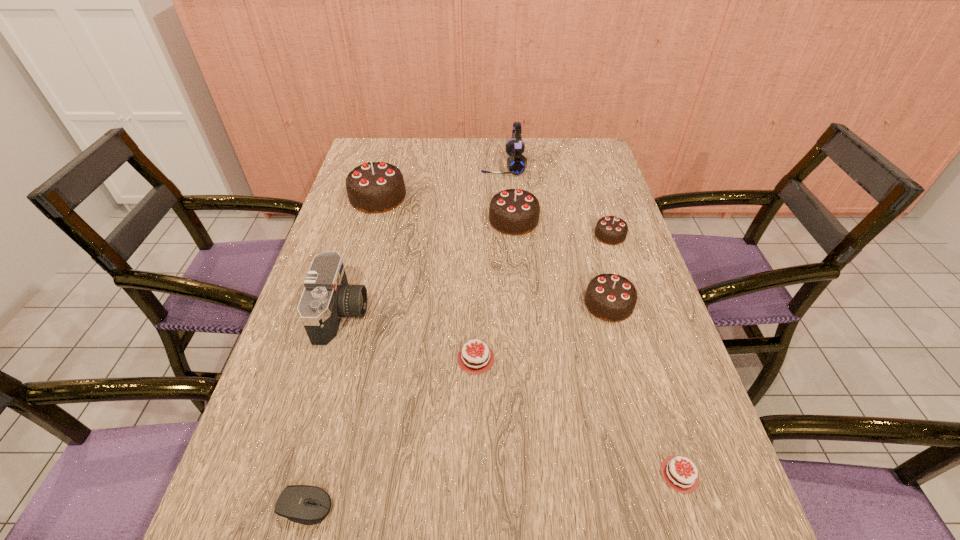
Image resolution: width=960 pixels, height=540 pixels. I want to click on the fifth tallest chocolate cake, so click(475, 360).

This screenshot has height=540, width=960. Identify the location of the farthest red chocolate cake. (475, 360).

Image resolution: width=960 pixels, height=540 pixels. In order to click on the sixth farthest chocolate cake in this screenshot , I will do tap(677, 475).

I want to click on the second smallest red chocolate cake, so click(677, 475).

Identify the location of computer equipment. (308, 505).

This screenshot has width=960, height=540. Find the location of `vacant space situated on the ear cushions of the headset`. vacant space situated on the ear cushions of the headset is located at coordinates (461, 166).

The height and width of the screenshot is (540, 960). Find the location of `vacant area situated on the ear cushions of the headset`. vacant area situated on the ear cushions of the headset is located at coordinates (418, 166).

The height and width of the screenshot is (540, 960). I want to click on vacant space situated on the ear cushions of the headset, so click(x=397, y=166).

Identify the location of free region located on the back of the tallest chocolate cake. This screenshot has width=960, height=540. (395, 138).

This screenshot has width=960, height=540. In order to click on vacant space located on the front-facing side of the black camera in this screenshot , I will do `click(471, 314)`.